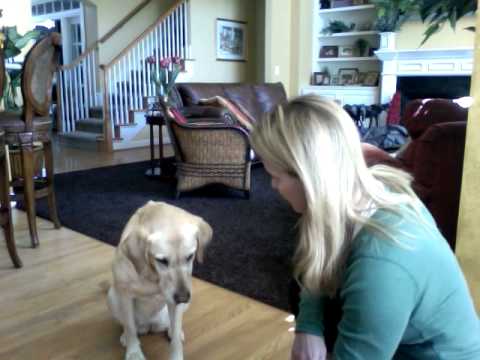
The image size is (480, 360). Find the location of `couch cushions`. couch cushions is located at coordinates (271, 87), (232, 92), (204, 92), (420, 113).